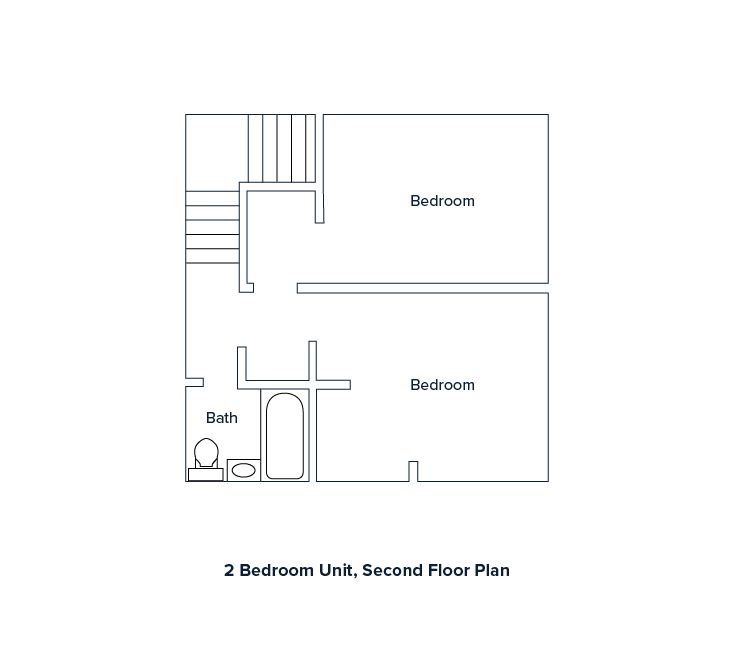
Locate an element on the screen. Image resolution: width=734 pixels, height=649 pixels. outline drawn of toilet is located at coordinates (207, 458).